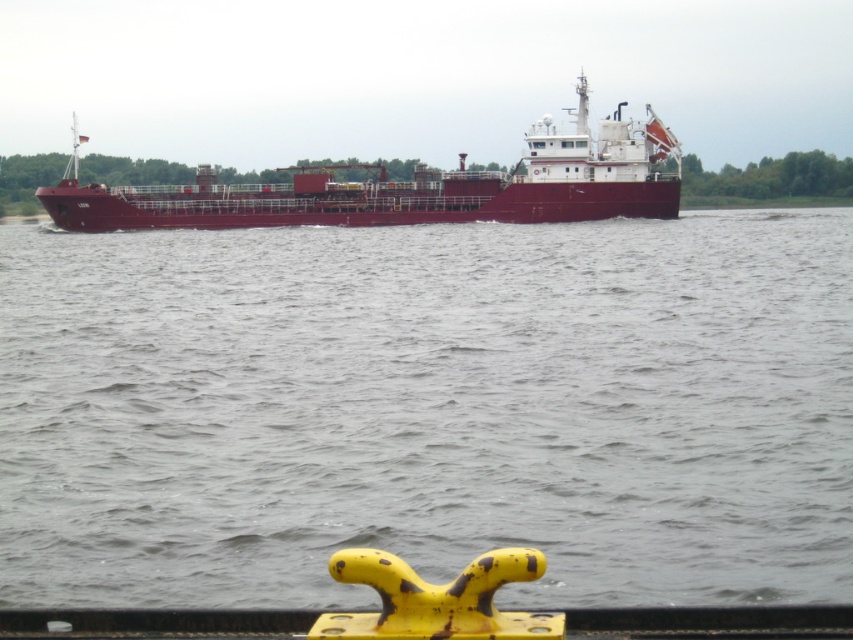
You are a sailor trying to navigate a small boat between the gray water at center and the maroon matte ship at center. Can your boat, which is 2 meters wide, safely pass through the space between them?

The gray water at center is thinner than the maroon matte ship at center. Since the water is thinner, the space between them may be narrower than the ship itself. However, without specific measurements, it is difficult to determine if the 2 meter wide boat can safely pass. Consider checking the exact dimensions or seeking further guidance.

You are on a boat and see the gray water at center and the maroon matte ship at center. Which object is located to the right side of the other?

The gray water at center is to the right of the maroon matte ship at center.